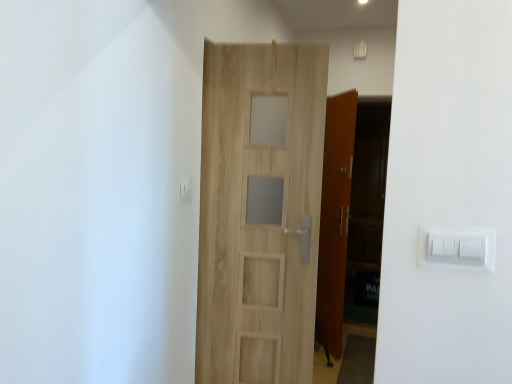
Question: Is white plastic light switch at right, marked as the first light switch in a right-to-left arrangement, bigger than light wood door at center?

Choices:
 (A) no
 (B) yes

Answer: (A)

Question: From a real-world perspective, does white plastic light switch at right, which appears as the 1th light switch when viewed from the front, stand above light wood door at center?

Choices:
 (A) no
 (B) yes

Answer: (B)

Question: Is white plastic light switch at right, acting as the first light switch starting from the bottom, facing away from light wood door at center?

Choices:
 (A) no
 (B) yes

Answer: (A)

Question: Is white plastic light switch at right, placed as the second light switch when sorted from top to bottom, positioned in front of light wood door at center?

Choices:
 (A) yes
 (B) no

Answer: (A)

Question: Considering the relative sizes of white plastic light switch at right, the 2th light switch positioned from the back, and light wood door at center in the image provided, is white plastic light switch at right, the 2th light switch positioned from the back, shorter than light wood door at center?

Choices:
 (A) yes
 (B) no

Answer: (A)

Question: From a real-world perspective, relative to white plastic light switch at upper center, arranged as the 1th light switch when viewed from the top, is light wood door at center vertically above or below?

Choices:
 (A) above
 (B) below

Answer: (B)

Question: Is point (246, 52) closer or farther from the camera than point (189, 182)?

Choices:
 (A) farther
 (B) closer

Answer: (A)

Question: Considering the positions of light wood door at center and white plastic light switch at upper center, arranged as the 1th light switch when viewed from the top, in the image, is light wood door at center taller or shorter than white plastic light switch at upper center, arranged as the 1th light switch when viewed from the top,?

Choices:
 (A) tall
 (B) short

Answer: (A)

Question: Is light wood door at center spatially inside white plastic light switch at upper center, which is the second light switch in bottom-to-top order, or outside of it?

Choices:
 (A) outside
 (B) inside

Answer: (A)

Question: Do you think light wood door at center is within white plastic light switch at right, arranged as the 2th light switch when viewed from the left, or outside of it?

Choices:
 (A) inside
 (B) outside

Answer: (B)

Question: Based on their positions, is light wood door at center located to the left or right of white plastic light switch at right, arranged as the 2th light switch when viewed from the left?

Choices:
 (A) left
 (B) right

Answer: (A)

Question: Is light wood door at center taller or shorter than white plastic light switch at right, arranged as the 2th light switch when viewed from the left?

Choices:
 (A) short
 (B) tall

Answer: (B)

Question: Relative to white plastic light switch at right, marked as the first light switch in a right-to-left arrangement, is light wood door at center in front or behind?

Choices:
 (A) behind
 (B) front

Answer: (A)

Question: Based on their positions, is white plastic light switch at right, placed as the second light switch when sorted from top to bottom, located to the left or right of white plastic light switch at upper center, arranged as the 1th light switch when viewed from the top?

Choices:
 (A) right
 (B) left

Answer: (A)

Question: Is white plastic light switch at right, placed as the second light switch when sorted from top to bottom, wider or thinner than white plastic light switch at upper center, the second light switch when ordered from front to back?

Choices:
 (A) wide
 (B) thin

Answer: (B)